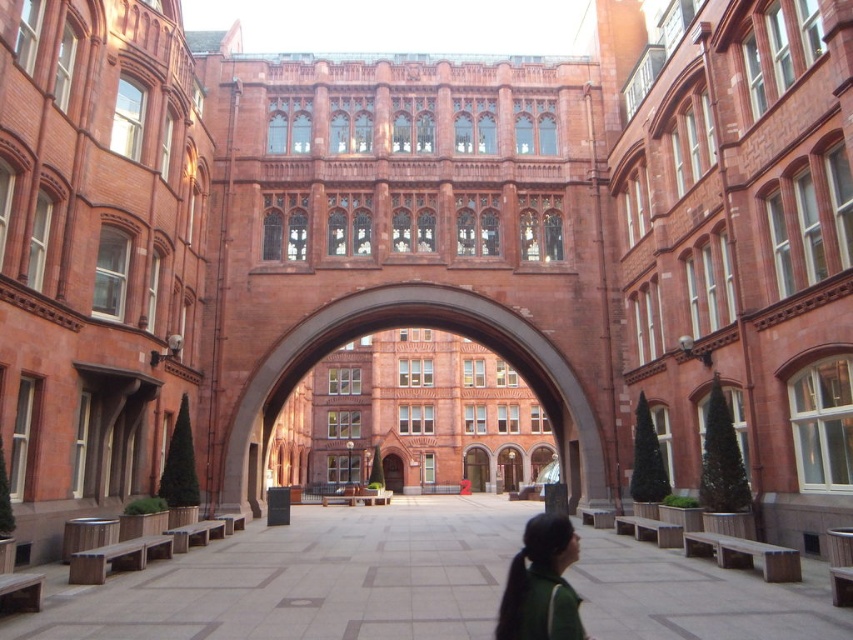
Does smooth stone pavement at center have a greater width compared to red brick archway at center?

Yes.

Is smooth stone pavement at center smaller than red brick archway at center?

Yes, smooth stone pavement at center is smaller than red brick archway at center.

Identify the location of smooth stone pavement at center. (306, 579).

Can you confirm if red brick archway at center is taller than green fabric at lower center?

Correct, red brick archway at center is much taller as green fabric at lower center.

Can you confirm if red brick archway at center is bigger than green fabric at lower center?

Indeed, red brick archway at center has a larger size compared to green fabric at lower center.

Between point (489, 332) and point (531, 524), which one is positioned behind?

Point (489, 332)

I want to click on red brick archway at center, so click(412, 324).

Does point (521, 524) come farther from viewer compared to point (567, 602)?

Yes, point (521, 524) is behind point (567, 602).

Is point (810, 627) farther from viewer compared to point (502, 628)?

Yes.

Where is `smooth stone pavement at center`? This screenshot has width=853, height=640. smooth stone pavement at center is located at coordinates (306, 579).